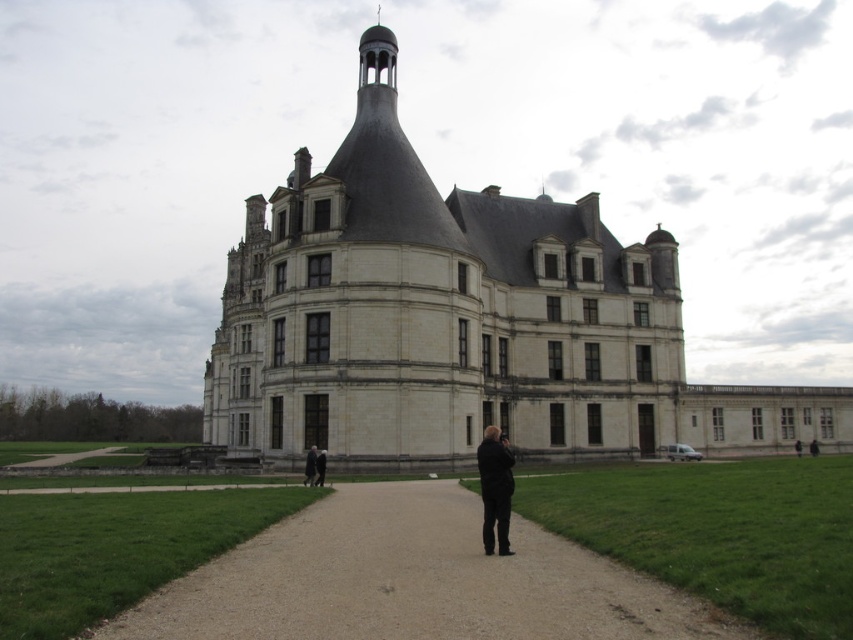
Is white stone castle at center taller than dirt/gravel path at center?

Yes.

Can you confirm if white stone castle at center is bigger than dirt/gravel path at center?

Indeed, white stone castle at center has a larger size compared to dirt/gravel path at center.

The image size is (853, 640). I want to click on white stone castle at center, so click(x=461, y=323).

Locate an element on the screen. Image resolution: width=853 pixels, height=640 pixels. white stone castle at center is located at coordinates (461, 323).

Does dirt/gravel path at center have a smaller size compared to black leather jacket at lower right?

Incorrect, dirt/gravel path at center is not smaller in size than black leather jacket at lower right.

Based on the photo, can you confirm if dirt/gravel path at center is positioned to the left of black leather jacket at lower right?

Indeed, dirt/gravel path at center is positioned on the left side of black leather jacket at lower right.

Is point (253, 620) farther from camera compared to point (798, 444)?

No, (253, 620) is closer to viewer.

The width and height of the screenshot is (853, 640). I want to click on dirt/gravel path at center, so click(x=413, y=580).

Describe the element at coordinates (413, 580) in the screenshot. I see `dirt/gravel path at center` at that location.

Between dirt/gravel path at center and dark brown leather jacket at lower right, which one appears on the left side from the viewer's perspective?

dirt/gravel path at center is more to the left.

Who is more forward, (x=386, y=573) or (x=814, y=449)?

Point (x=386, y=573) is in front.

Find the location of a particular element. dirt/gravel path at center is located at coordinates (413, 580).